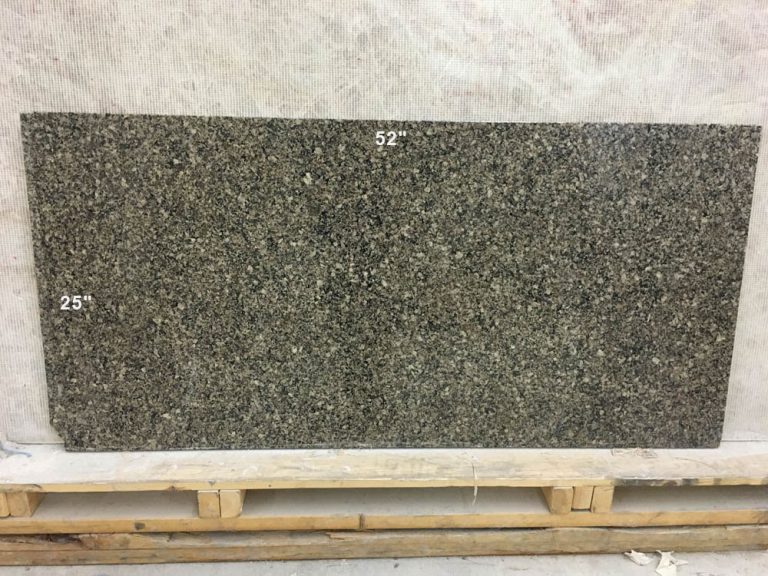
Find the location of a particular element. The height and width of the screenshot is (576, 768). wood platform is located at coordinates (161, 529), (382, 526), (732, 526).